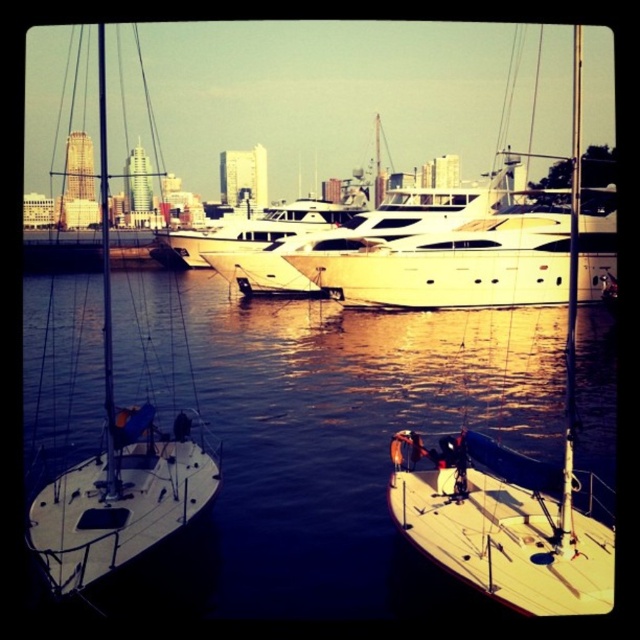
Is white matte sailboat at lower right to the left of wooden sailboat at center from the viewer's perspective?

No, white matte sailboat at lower right is not to the left of wooden sailboat at center.

The height and width of the screenshot is (640, 640). What do you see at coordinates (513, 490) in the screenshot? I see `white matte sailboat at lower right` at bounding box center [513, 490].

Between point (566, 406) and point (588, 499), which one is positioned in front?

Positioned in front is point (566, 406).

This screenshot has height=640, width=640. What are the coordinates of `white matte sailboat at lower right` in the screenshot? It's located at (513, 490).

Can you confirm if white matte sailboat at left is positioned to the right of wooden sailboat at center?

In fact, white matte sailboat at left is to the left of wooden sailboat at center.

From the picture: Is white matte sailboat at left further to camera compared to wooden sailboat at center?

Yes, white matte sailboat at left is further from the viewer.

Find the location of a particular element. white matte sailboat at left is located at coordinates (116, 433).

Can you confirm if white matte sailboat at left is wider than white glossy yacht at center?

Indeed, white matte sailboat at left has a greater width compared to white glossy yacht at center.

The width and height of the screenshot is (640, 640). I want to click on white matte sailboat at left, so click(116, 433).

Is point (49, 497) behind point (353, 276)?

No, it is not.

This screenshot has height=640, width=640. I want to click on white matte sailboat at left, so click(x=116, y=433).